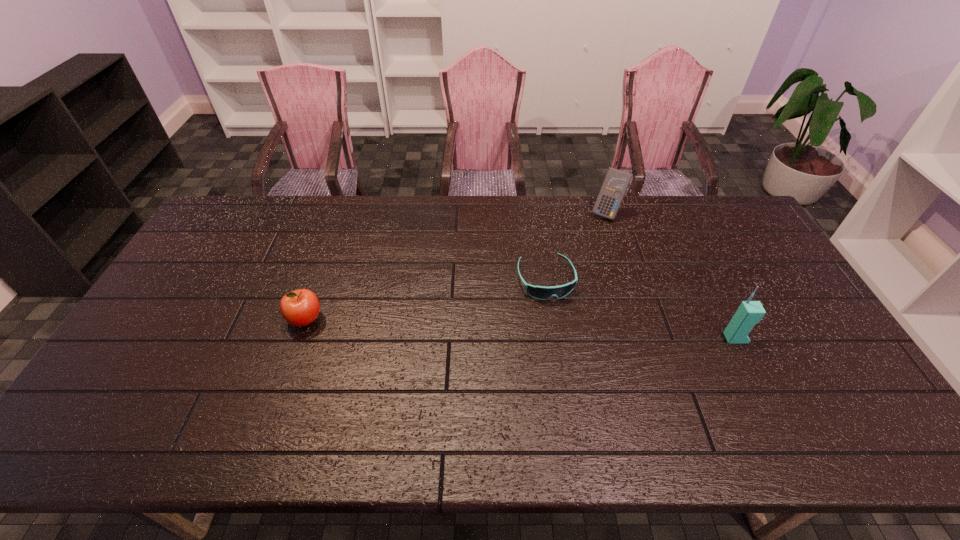
The image size is (960, 540). In order to click on empty space that is in between the third object from left to right and the apple in this screenshot , I will do [x=456, y=266].

Where is `vacant area that lies between the cellular telephone and the third object from right to left`? The height and width of the screenshot is (540, 960). vacant area that lies between the cellular telephone and the third object from right to left is located at coordinates (640, 309).

The height and width of the screenshot is (540, 960). In order to click on vacant point located between the second farthest object and the apple in this screenshot , I will do `click(425, 299)`.

Select which object appears as the third closest to the rightmost object. Please provide its 2D coordinates. Your answer should be formatted as a tuple, i.e. [(x, y)], where the tuple contains the x and y coordinates of a point satisfying the conditions above.

[(301, 307)]

Find the location of a particular element. object that stands as the closest to the rightmost object is located at coordinates (539, 292).

Image resolution: width=960 pixels, height=540 pixels. I want to click on vacant space that satisfies the following two spatial constraints: 1. on the front side of the second tallest object; 2. on the keypad of the cellular telephone, so click(647, 338).

At what (x,y) coordinates should I click in order to perform the action: click on free space that satisfies the following two spatial constraints: 1. on the front side of the shortest object; 2. on the keypad of the rightmost object. Please return your answer as a coordinate pair (x, y). This screenshot has height=540, width=960. Looking at the image, I should click on (554, 338).

Where is `vacant space that satisfies the following two spatial constraints: 1. on the front side of the cellular telephone; 2. on the keypad of the third shortest object`? Image resolution: width=960 pixels, height=540 pixels. vacant space that satisfies the following two spatial constraints: 1. on the front side of the cellular telephone; 2. on the keypad of the third shortest object is located at coordinates (647, 338).

Find the location of a particular element. The image size is (960, 540). free space in the image that satisfies the following two spatial constraints: 1. on the front side of the rightmost object; 2. on the keypad of the farthest object is located at coordinates (647, 338).

Where is `vacant area that satisfies the following two spatial constraints: 1. on the front side of the third object from right to left; 2. on the keypad of the rightmost object`? vacant area that satisfies the following two spatial constraints: 1. on the front side of the third object from right to left; 2. on the keypad of the rightmost object is located at coordinates (554, 338).